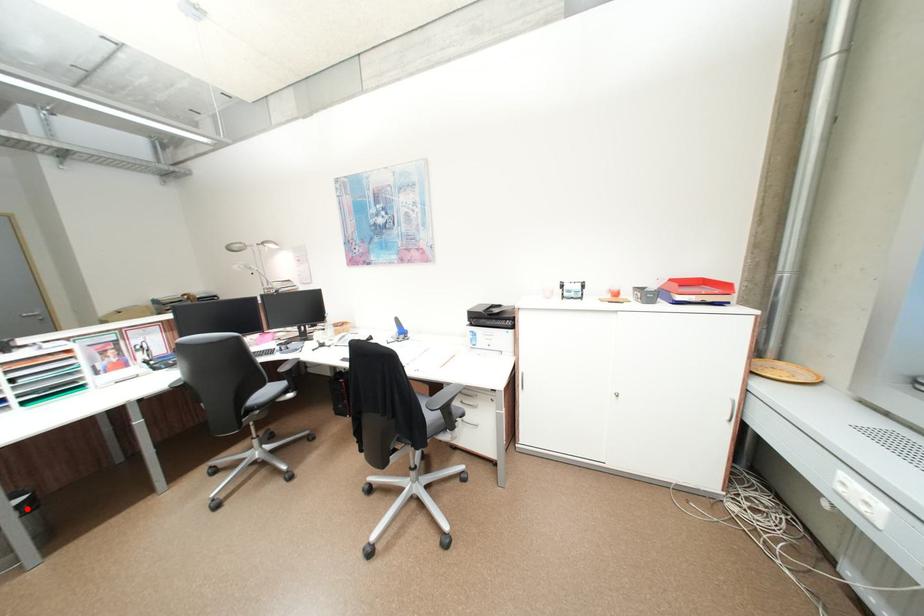
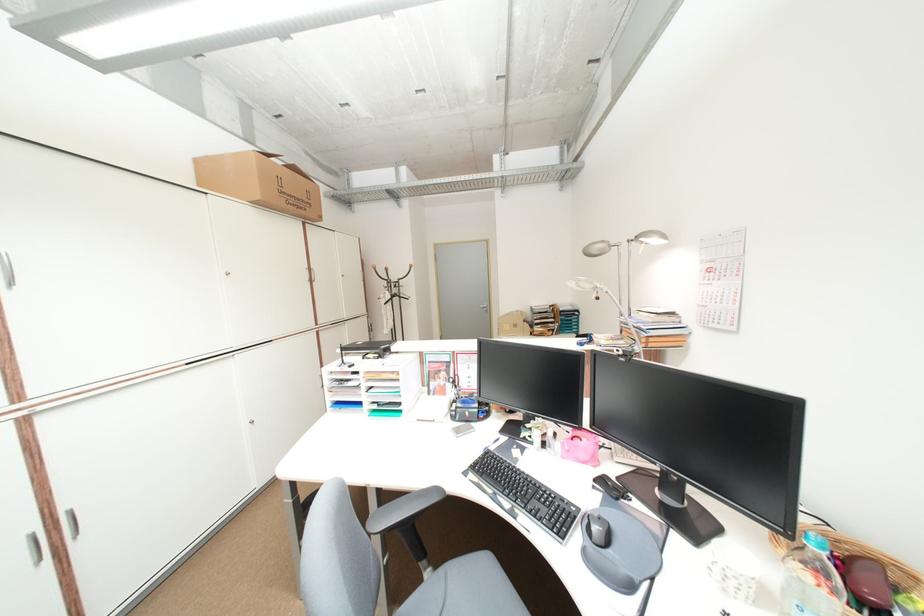
Question: I am providing you with two images of the same scene from different viewpoints. A red point is marked on the first image. At the location where the point appears in image 1, is it still visible in image 2?

Choices:
 (A) Yes
 (B) No

Answer: (B)